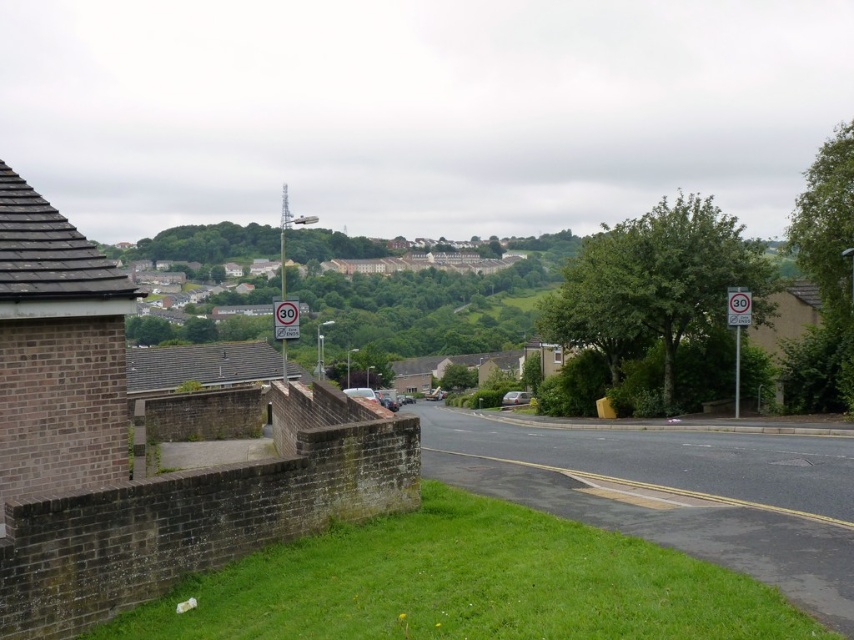
Consider the image. You are driving a car that is 5 meters long. You see the white plastic speed limit sign at right and the metallic silver speed limit sign at center ahead on the road. Can your entire car fit between them while staying on the road?

The distance between the white plastic speed limit sign at right and the metallic silver speed limit sign at center is 14.07 meters. Since your car is 5 meters long, it can easily fit between them as there is sufficient space.

You are a pedestrian standing at the bottom left corner of the image. You want to walk to the white plastic speed limit sign at right and the metallic silver speed limit sign at center. Which sign should you reach first?

The metallic silver speed limit sign at center is below the white plastic speed limit sign at right. Since you are starting from the bottom left, you would reach the metallic silver speed limit sign at center first before the one above it.